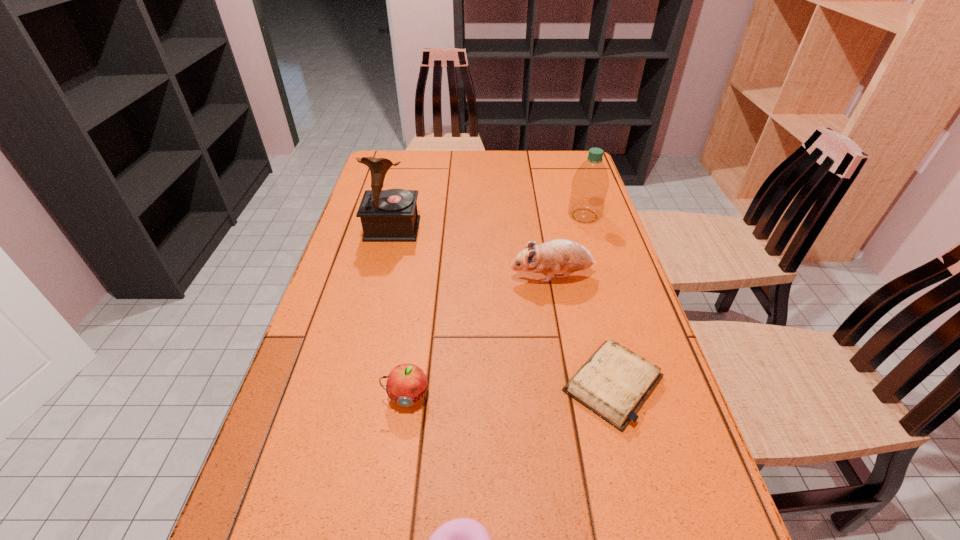
You are a GUI agent. You are given a task and a screenshot of the screen. Output one action in this format:
    pyautogui.click(x=<x>, y=<y>)
    Task: Click on the free space located 0.330m at the face of the third tallest object
    Image resolution: width=960 pixels, height=540 pixels.
    Given the screenshot: What is the action you would take?
    pyautogui.click(x=387, y=276)

In order to click on free space located 0.190m on the right of the apple in this screenshot , I will do tap(521, 396).

At what (x,y) coordinates should I click in order to perform the action: click on free space located 0.140m on the back of the shortest object. Please return your answer as a coordinate pair (x, y). Looking at the image, I should click on (591, 300).

In order to click on object that is at the left edge in this screenshot , I will do `click(391, 215)`.

Image resolution: width=960 pixels, height=540 pixels. Find the location of `water bottle situated at the right edge`. water bottle situated at the right edge is located at coordinates (590, 183).

The height and width of the screenshot is (540, 960). Identify the location of hamster that is at the right edge. (565, 256).

Find the location of a particular element. This screenshot has width=960, height=540. diary at the right edge is located at coordinates (614, 382).

Image resolution: width=960 pixels, height=540 pixels. Identify the location of vacant space at the far edge. (460, 170).

Find the location of `vacant space at the left edge of the desktop`. vacant space at the left edge of the desktop is located at coordinates (331, 277).

Image resolution: width=960 pixels, height=540 pixels. What are the coordinates of `free space at the right edge of the desktop` in the screenshot? It's located at (558, 191).